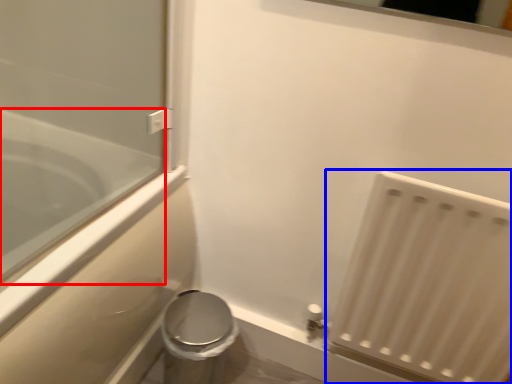
Question: Which point is closer to the camera, bathtub (highlighted by a red box) or radiator (highlighted by a blue box)?

Choices:
 (A) bathtub
 (B) radiator

Answer: (A)